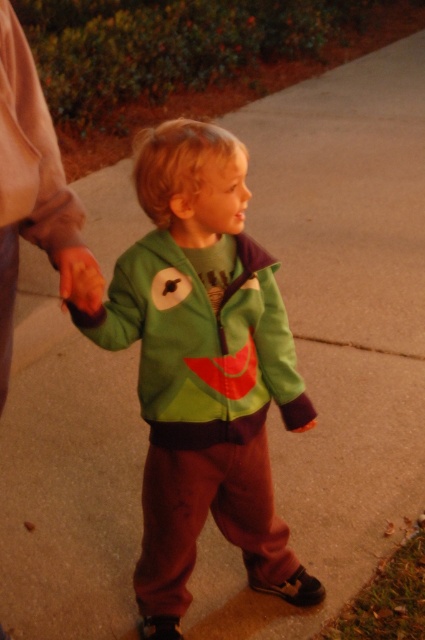
Question: Based on their relative distances, which object is farther from the smooth orange hand at lower left?

Choices:
 (A) green matte jacket at center
 (B) green soft jacket at center

Answer: (A)

Question: Where is green soft jacket at center located in relation to smooth orange hand at lower left in the image?

Choices:
 (A) below
 (B) above

Answer: (A)

Question: Based on their relative distances, which object is nearer to the green soft jacket at center?

Choices:
 (A) smooth orange hand at lower left
 (B) green matte jacket at center

Answer: (B)

Question: Does green matte jacket at center lie behind green soft jacket at center?

Choices:
 (A) no
 (B) yes

Answer: (B)

Question: Which object is closer to the camera taking this photo?

Choices:
 (A) green soft jacket at center
 (B) green matte jacket at center

Answer: (A)

Question: Does green matte jacket at center have a lesser width compared to smooth orange hand at lower left?

Choices:
 (A) no
 (B) yes

Answer: (A)